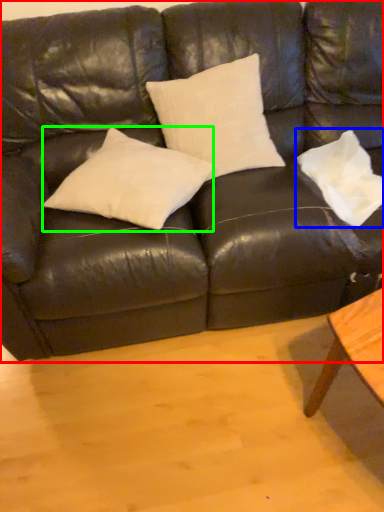
Question: Based on their relative distances, which object is farther from studio couch (highlighted by a red box)? Choose from pillow (highlighted by a blue box) and pillow (highlighted by a green box).

Choices:
 (A) pillow
 (B) pillow

Answer: (A)